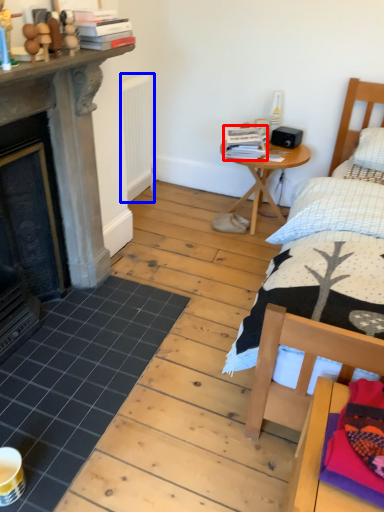
Question: Which point is closer to the camera, book (highlighted by a red box) or radiator (highlighted by a blue box)?

Choices:
 (A) book
 (B) radiator

Answer: (B)